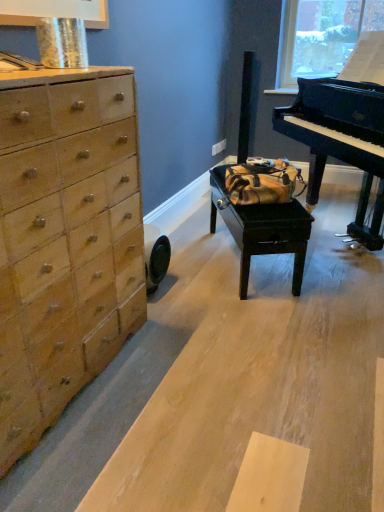
Question: Is wooden table at center bigger or smaller than light brown wood chest of drawers at left?

Choices:
 (A) small
 (B) big

Answer: (A)

Question: Based on their positions, is wooden table at center located to the left or right of light brown wood chest of drawers at left?

Choices:
 (A) right
 (B) left

Answer: (A)

Question: Which is farther from the wooden table at center?

Choices:
 (A) natural wood plywood at lower left
 (B) shiny black piano at right
 (C) light brown wood chest of drawers at left

Answer: (C)

Question: Estimate the real-world distances between objects in this image. Which object is closer to the light brown wood chest of drawers at left?

Choices:
 (A) natural wood plywood at lower left
 (B) shiny black piano at right
 (C) wooden table at center

Answer: (A)